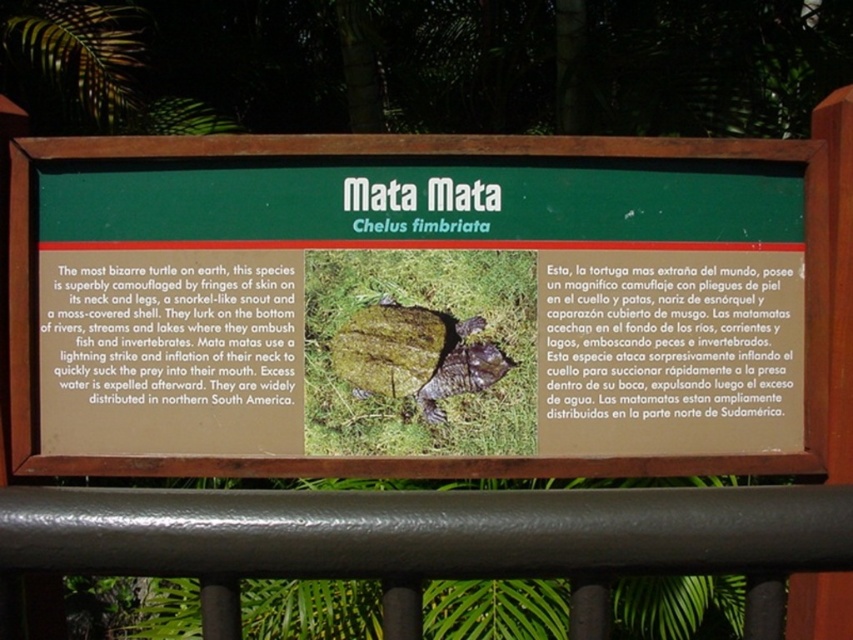
Between green matte turtle at center and green moss-covered turtle at center, which one has more height?

With more height is green matte turtle at center.

Can you confirm if green matte turtle at center is smaller than green moss-covered turtle at center?

No.

Does point (648, 451) come farther from viewer compared to point (473, 364)?

Yes, it is behind point (473, 364).

Locate an element on the screen. The image size is (853, 640). green matte turtle at center is located at coordinates (422, 248).